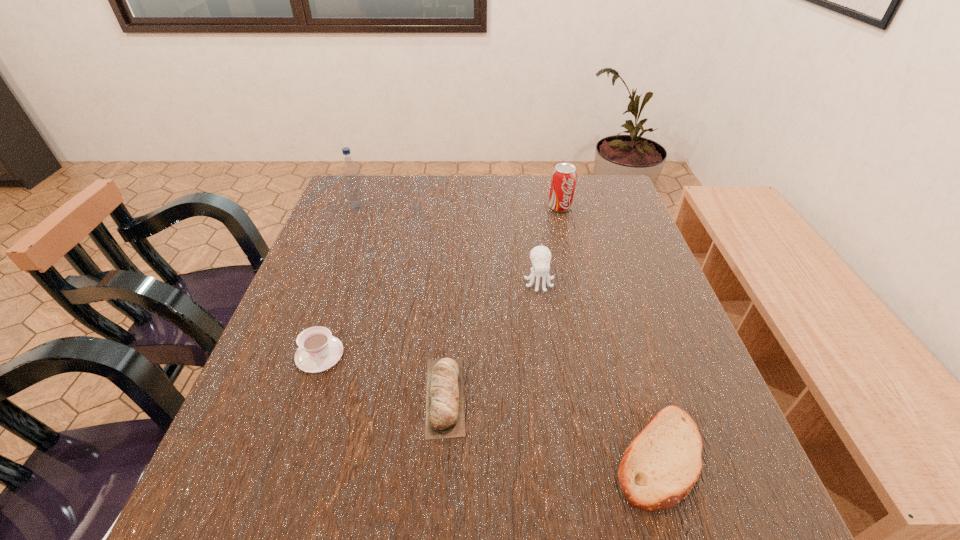
Where is `pita bread present at the right edge`? pita bread present at the right edge is located at coordinates (660, 467).

This screenshot has width=960, height=540. Identify the location of object that is at the far left corner. (350, 171).

Image resolution: width=960 pixels, height=540 pixels. Identify the location of object positioned at the far right corner. (564, 176).

What are the coordinates of `object that is at the near right corner` in the screenshot? It's located at (660, 467).

The width and height of the screenshot is (960, 540). I want to click on vacant area at the far edge, so click(x=482, y=185).

Where is `blank space at the near edge`? The width and height of the screenshot is (960, 540). blank space at the near edge is located at coordinates (607, 526).

This screenshot has width=960, height=540. What are the coordinates of `free space at the left edge` in the screenshot? It's located at (328, 254).

The image size is (960, 540). Identify the location of free space at the right edge. (731, 459).

At what (x,y) coordinates should I click in order to perform the action: click on free region at the far left corner of the desktop. Please return your answer as a coordinate pair (x, y). Looking at the image, I should click on (377, 177).

You are a GUI agent. You are given a task and a screenshot of the screen. Output one action in this format:
    pyautogui.click(x=<x>, y=<y>)
    Task: Click on the free spot between the soda can and the third object from right to left
    
    Given the screenshot: What is the action you would take?
    pyautogui.click(x=549, y=244)